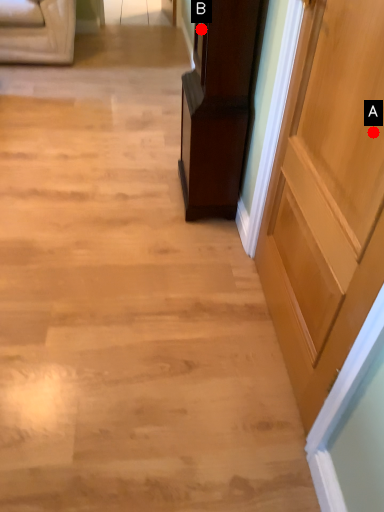
Question: Two points are circled on the image, labeled by A and B beside each circle. Among these points, which one is nearest to the camera?

Choices:
 (A) A is closer
 (B) B is closer

Answer: (A)